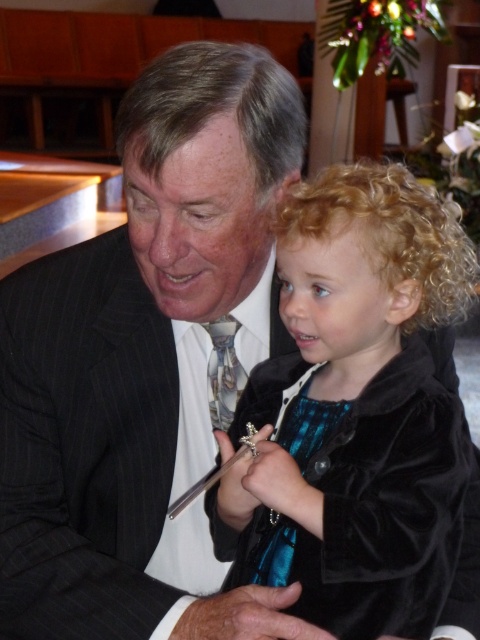
You are a photographer at a formal event. You need to capture a closeup shot of the velvet black jacket at center and the patterned silk tie at center. Which one should you focus on if you want to highlight the larger object in the frame?

The velvet black jacket at center is bigger than the patterned silk tie at center, so you should focus on the velvet black jacket at center to highlight the larger object in the frame.

You are an event planner arranging seating for a ceremony. You need to ensure that the velvet black jacket at center and the patterned silk tie at center are visible to all attendees. Given their relative sizes, which one should be placed closer to the front of the stage to ensure visibility?

The velvet black jacket at center is much taller than the patterned silk tie at center, so it should be placed further back on the stage to allow the shorter patterned silk tie at center to be more visible from the front rows.

You are a photographer at a formal event. You need to capture a closeup shot of the velvet black jacket at center and the patterned silk tie at center. The camera you are using has a maximum focus range of 12 inches. Will you be able to focus on both items simultaneously?

The velvet black jacket at center and patterned silk tie at center are 12.07 inches apart. Since the distance between them exceeds the camera maximum focus range of 12 inches, you won not be able to focus on both items simultaneously.